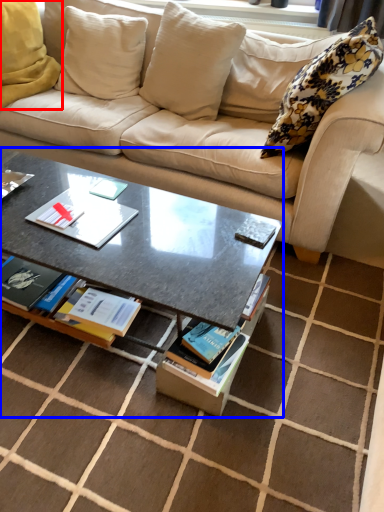
Question: Which of the following is the closest to the observer, pillow (highlighted by a red box) or coffee table (highlighted by a blue box)?

Choices:
 (A) pillow
 (B) coffee table

Answer: (B)